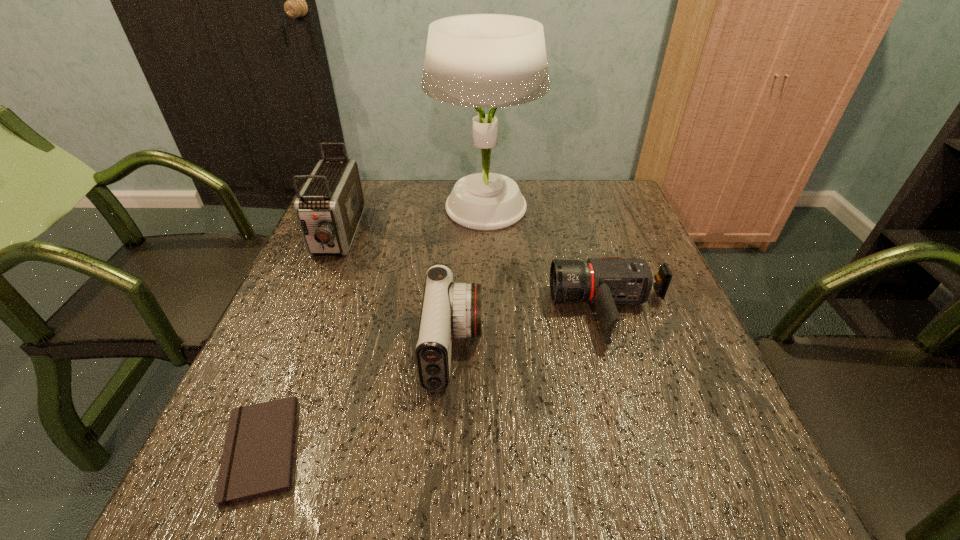
At what (x,y) coordinates should I click in order to perform the action: click on object at the near edge. Please return your answer as a coordinate pair (x, y). Looking at the image, I should click on (257, 461).

The width and height of the screenshot is (960, 540). I want to click on camcorder at the left edge, so click(329, 207).

Identify the location of checkbook that is at the left edge. (257, 461).

The width and height of the screenshot is (960, 540). What are the coordinates of `object positioned at the right edge` in the screenshot? It's located at (605, 282).

Where is `object located in the far left corner section of the desktop`? The height and width of the screenshot is (540, 960). object located in the far left corner section of the desktop is located at coordinates (329, 207).

You are a GUI agent. You are given a task and a screenshot of the screen. Output one action in this format:
    pyautogui.click(x=<x>, y=<y>)
    Task: Click on the object that is at the near left corner
    This screenshot has width=960, height=540.
    Given the screenshot: What is the action you would take?
    pyautogui.click(x=257, y=461)

Locate an element on the screen. The height and width of the screenshot is (540, 960). vacant area at the far edge of the desktop is located at coordinates (558, 193).

I want to click on vacant region at the near edge, so click(538, 506).

Identify the location of free space at the left edge. (297, 307).

Where is `vacant space at the right edge`? Image resolution: width=960 pixels, height=540 pixels. vacant space at the right edge is located at coordinates (674, 323).